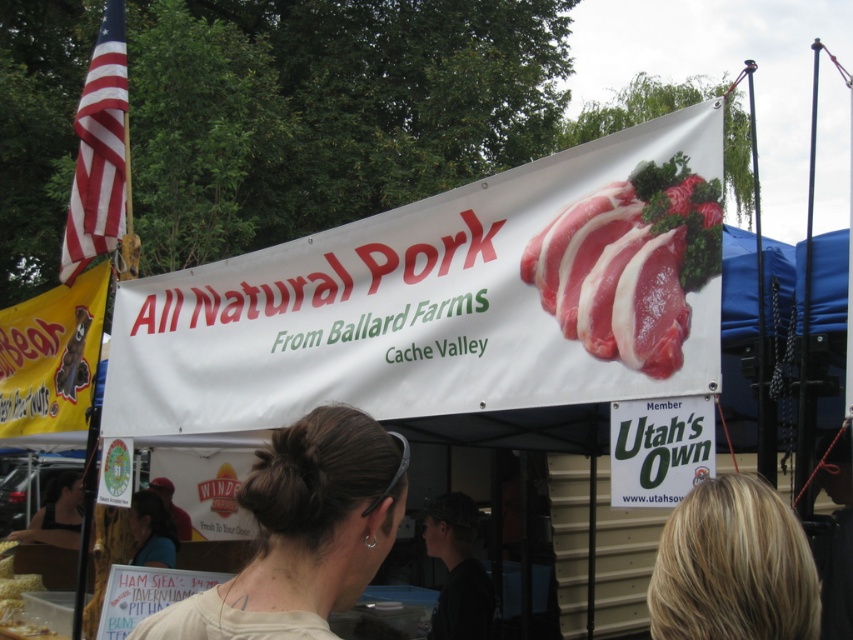
The height and width of the screenshot is (640, 853). Find the location of `light beige fabric at center`. light beige fabric at center is located at coordinates point(303,532).

Is light beige fabric at center bigger than raw pink meat at center?

No.

Identify the location of light beige fabric at center. [x=303, y=532].

Find the location of a particular element. light beige fabric at center is located at coordinates (303, 532).

Does light beige fabric at center lie in front of blonde hair at upper center?

No, it is behind blonde hair at upper center.

Can you confirm if light beige fabric at center is bigger than blonde hair at upper center?

Yes.

This screenshot has width=853, height=640. What are the coordinates of `light beige fabric at center` in the screenshot? It's located at (303, 532).

The width and height of the screenshot is (853, 640). Identify the location of light beige fabric at center. click(x=303, y=532).

Is point (645, 285) farther from camera compared to point (672, 568)?

Yes, it is behind point (672, 568).

Looking at this image, can you confirm if raw pink meat at center is wider than blonde hair at upper center?

Yes, raw pink meat at center is wider than blonde hair at upper center.

Who is more distant from viewer, (x=695, y=260) or (x=689, y=566)?

Point (x=695, y=260)

At what (x,y) coordinates should I click in order to perform the action: click on raw pink meat at center. Please return your answer as a coordinate pair (x, y). Image resolution: width=853 pixels, height=640 pixels. Looking at the image, I should click on (630, 262).